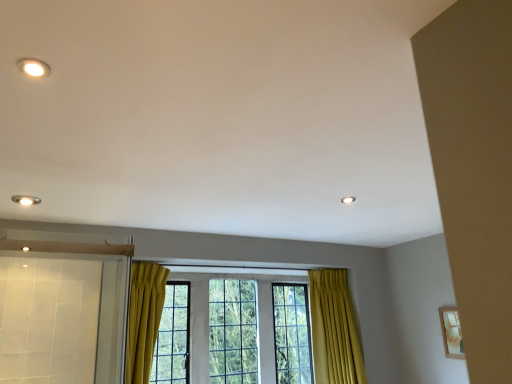
The height and width of the screenshot is (384, 512). Describe the element at coordinates (33, 67) in the screenshot. I see `matte white light fixture at upper left` at that location.

Image resolution: width=512 pixels, height=384 pixels. I want to click on matte white light fixture at upper left, so click(x=33, y=67).

Image resolution: width=512 pixels, height=384 pixels. Describe the element at coordinates (334, 329) in the screenshot. I see `clear glass window at center` at that location.

Measure the distance between point [343,279] and camera.

The distance of point [343,279] from camera is 3.69 meters.

This screenshot has height=384, width=512. Find the location of `clear glass window at center`. clear glass window at center is located at coordinates [x=334, y=329].

Find the location of `matte white light fixture at upper left`. matte white light fixture at upper left is located at coordinates (33, 67).

Considering the relative positions of clear glass window at center and matte white light fixture at upper left in the image provided, is clear glass window at center to the right of matte white light fixture at upper left from the viewer's perspective?

Yes.

Considering the positions of objects clear glass window at center and matte white light fixture at upper left in the image provided, who is in front, clear glass window at center or matte white light fixture at upper left?

matte white light fixture at upper left is more forward.

Is point (154, 316) farther from camera compared to point (32, 70)?

Yes, point (154, 316) is behind point (32, 70).

From the image's perspective, does clear glass window at center appear lower than matte white light fixture at upper left?

Yes, from the image's perspective, clear glass window at center is below matte white light fixture at upper left.

From a real-world perspective, is clear glass window at center on matte white light fixture at upper left?

No, from a real-world perspective, clear glass window at center is not on top of matte white light fixture at upper left.

Between clear glass window at center and matte white light fixture at upper left, which one has smaller width?

matte white light fixture at upper left is thinner.

Between clear glass window at center and matte white light fixture at upper left, which one has less height?

matte white light fixture at upper left.

Is clear glass window at center smaller than matte white light fixture at upper left?

No.

Would you say clear glass window at center is inside or outside matte white light fixture at upper left?

clear glass window at center is outside matte white light fixture at upper left.

Are clear glass window at center and matte white light fixture at upper left beside each other?

No.

Is clear glass window at center positioned with its back to matte white light fixture at upper left?

clear glass window at center is not turned away from matte white light fixture at upper left.

How many degrees apart are the facing directions of clear glass window at center and matte white light fixture at upper left?

170 degrees.

The height and width of the screenshot is (384, 512). In order to click on window below the matte white light fixture at upper left (from a real-world perspective) in this screenshot , I will do `click(334, 329)`.

Considering the positions of objects matte white light fixture at upper left and clear glass window at center in the image provided, who is more to the left, matte white light fixture at upper left or clear glass window at center?

matte white light fixture at upper left is more to the left.

Is matte white light fixture at upper left in front of or behind clear glass window at center in the image?

matte white light fixture at upper left is positioned closer to the viewer than clear glass window at center.

Which point is more forward, (41, 66) or (347, 323)?

Positioned in front is point (41, 66).

From the image's perspective, which is above, matte white light fixture at upper left or clear glass window at center?

From the image's view, matte white light fixture at upper left is above.

From a real-world perspective, is matte white light fixture at upper left on top of clear glass window at center?

Correct, in the physical world, matte white light fixture at upper left is higher than clear glass window at center.

Considering the sizes of objects matte white light fixture at upper left and clear glass window at center in the image provided, who is wider, matte white light fixture at upper left or clear glass window at center?

With larger width is clear glass window at center.

Between matte white light fixture at upper left and clear glass window at center, which one has less height?

With less height is matte white light fixture at upper left.

Is matte white light fixture at upper left smaller than clear glass window at center?

Indeed, matte white light fixture at upper left has a smaller size compared to clear glass window at center.

Is clear glass window at center completely or partially inside matte white light fixture at upper left?

Definitely not — clear glass window at center is not inside matte white light fixture at upper left.

Are matte white light fixture at upper left and clear glass window at center far apart?

matte white light fixture at upper left is positioned a significant distance from clear glass window at center.

Is matte white light fixture at upper left turned away from clear glass window at center?

No, matte white light fixture at upper left is not facing the opposite direction of clear glass window at center.

How different are the orientations of matte white light fixture at upper left and clear glass window at center in degrees?

170 degrees separate the facing orientations of matte white light fixture at upper left and clear glass window at center.

What are the coordinates of `window located below the matte white light fixture at upper left (from the image's perspective)` in the screenshot? It's located at (334, 329).

You are a GUI agent. You are given a task and a screenshot of the screen. Output one action in this format:
    pyautogui.click(x=<x>, y=<y>)
    Task: Click on the lighting positioned vertically above the clear glass window at center (from a real-world perspective)
    The image size is (512, 384).
    Given the screenshot: What is the action you would take?
    pyautogui.click(x=33, y=67)

I want to click on lighting to the left of clear glass window at center, so click(x=33, y=67).